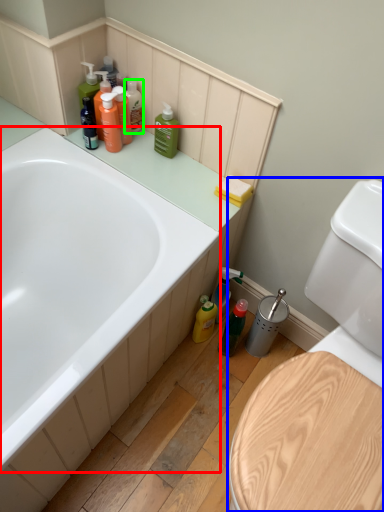
Question: Considering the real-world distances, which object is closest to bathtub (highlighted by a red box)? toilet (highlighted by a blue box) or toiletry (highlighted by a green box).

Choices:
 (A) toilet
 (B) toiletry

Answer: (B)